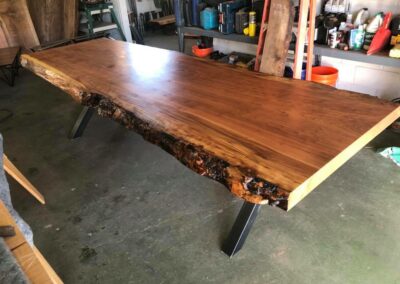
Locate an element on the screen. orange dust pan is located at coordinates pyautogui.click(x=382, y=37).